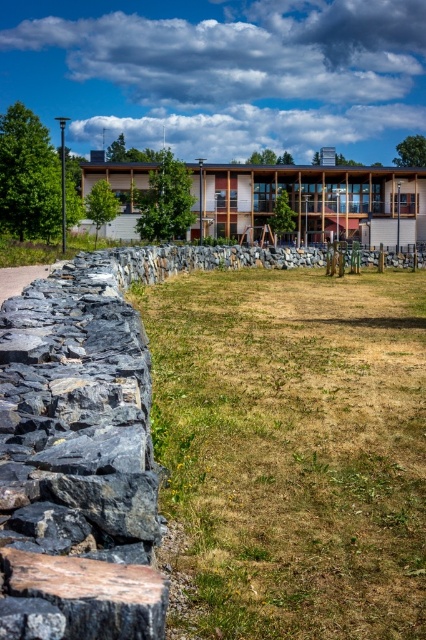
You are a landscape architect evaluating the outdoor space. The dry grass at center and the dark gray rough stone wall at left are part of the design. Based on their height, which element is more suitable for creating a visual barrier between the pathway and the building?

The dark gray rough stone wall at left is more suitable for creating a visual barrier between the pathway and the building because it is taller than the dry grass at center.

You are standing at the entrance of the modern building and want to place a decorative stone sculpture. The sculpture requires a flat area at the center of the scene. Is the dry grass at center suitable for placing the sculpture?

The dry grass at center is located at point (290, 451), which is the center of the scene. Therefore, it is suitable for placing the decorative stone sculpture as it meets the requirement of being at the center.

You are a landscape architect designing a garden. You have a decorative stone wall that is 10 feet long. You want to place a patch of dry grass in your design so that it is exactly 10 feet away from the wall. Based on the scene, will the existing dry grass at center and dark gray rough stone wall at left in the image meet your design requirements?

The dry grass at center is 9.81 feet from the dark gray rough stone wall at left, which is very close to the desired 10 feet distance. This placement could be considered acceptable depending on the project tolerance for slight variations in measurement.